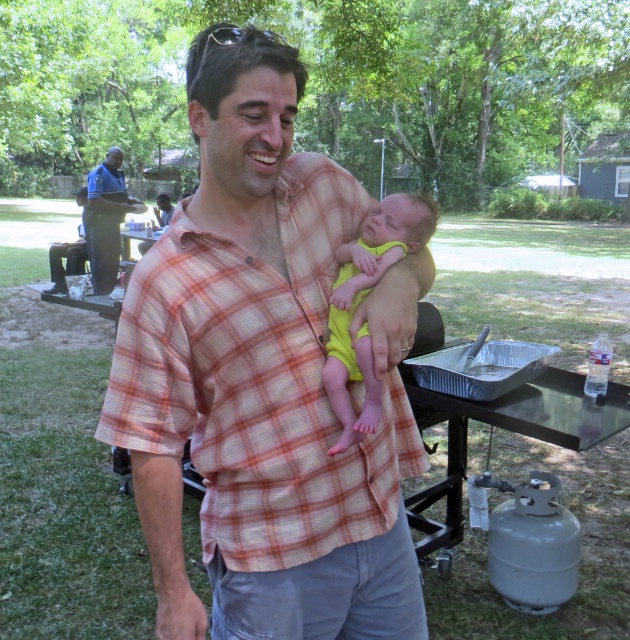
Question: Among these points, which one is farthest from the camera?

Choices:
 (A) (105, 275)
 (B) (273, 490)
 (C) (449, 340)
 (D) (338, 419)

Answer: (A)

Question: Is plaid shirt at center behind yellow fabric baby at center?

Choices:
 (A) yes
 (B) no

Answer: (B)

Question: Which is nearer to the plaid shirt at center?

Choices:
 (A) blue shirt at upper left
 (B) metallic aluminum picnic table at lower right
 (C) yellow fabric baby at center

Answer: (C)

Question: Does plaid shirt at center appear on the right side of blue shirt at upper left?

Choices:
 (A) yes
 (B) no

Answer: (A)

Question: Which of the following is the closest to the observer?

Choices:
 (A) (98, 209)
 (B) (335, 301)

Answer: (B)

Question: In this image, where is metallic aluminum picnic table at lower right located relative to blue shirt at upper left?

Choices:
 (A) left
 (B) right

Answer: (B)